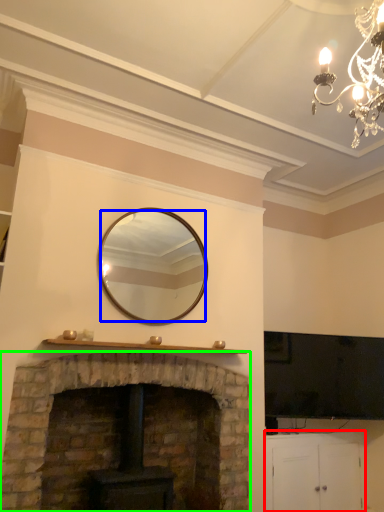
Question: Considering the real-world distances, which object is farthest from cabinetry (highlighted by a red box)? mirror (highlighted by a blue box) or fireplace (highlighted by a green box)?

Choices:
 (A) mirror
 (B) fireplace

Answer: (A)